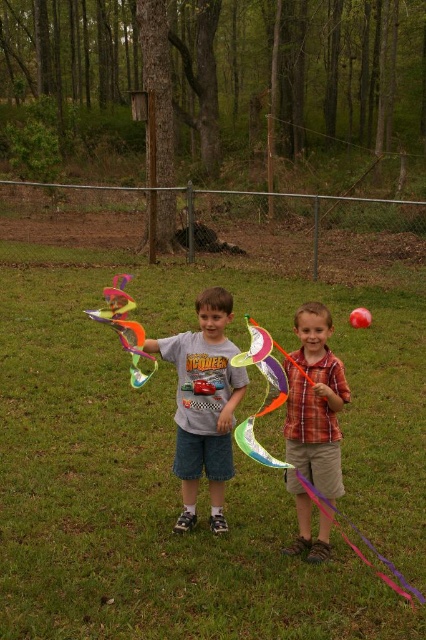
Question: Can you confirm if plaid cotton shirt at center is positioned above rainbow plastic kite at center?

Choices:
 (A) no
 (B) yes

Answer: (B)

Question: Which point is farther from the camera taking this photo?

Choices:
 (A) (313, 317)
 (B) (126, 282)
 (C) (287, 358)
 (D) (201, 390)

Answer: (B)

Question: Is gray cotton t-shirt at center to the left of translucent plastic kite at center from the viewer's perspective?

Choices:
 (A) yes
 (B) no

Answer: (B)

Question: From the image, what is the correct spatial relationship of plaid cotton shirt at center in relation to shiny metallic kite at center?

Choices:
 (A) left
 (B) right

Answer: (B)

Question: Which of the following is the farthest from the observer?

Choices:
 (A) shiny metallic kite at center
 (B) translucent plastic kite at center
 (C) gray cotton t-shirt at center

Answer: (C)

Question: Among these objects, which one is farthest from the camera?

Choices:
 (A) gray cotton t-shirt at center
 (B) translucent plastic kite at center
 (C) rainbow plastic kite at center
 (D) plaid cotton shirt at center

Answer: (A)